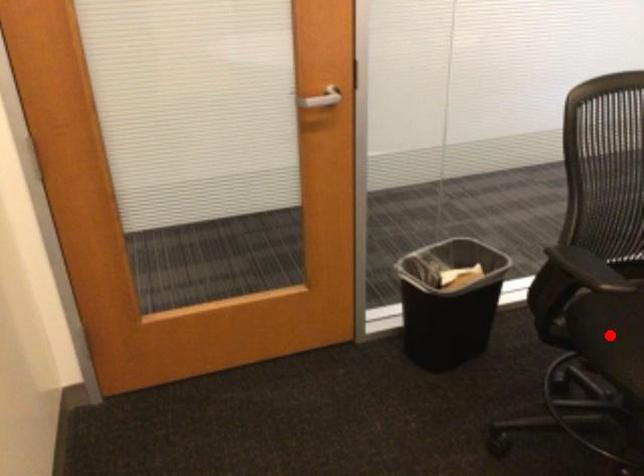
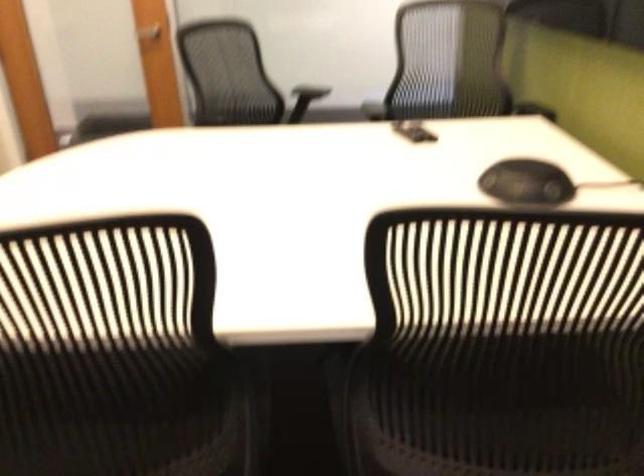
Question: I am providing you with two images of the same scene from different viewpoints. A red point is marked on the first image. Is the red point's position out of view in image 2?

Choices:
 (A) Yes
 (B) No

Answer: (A)